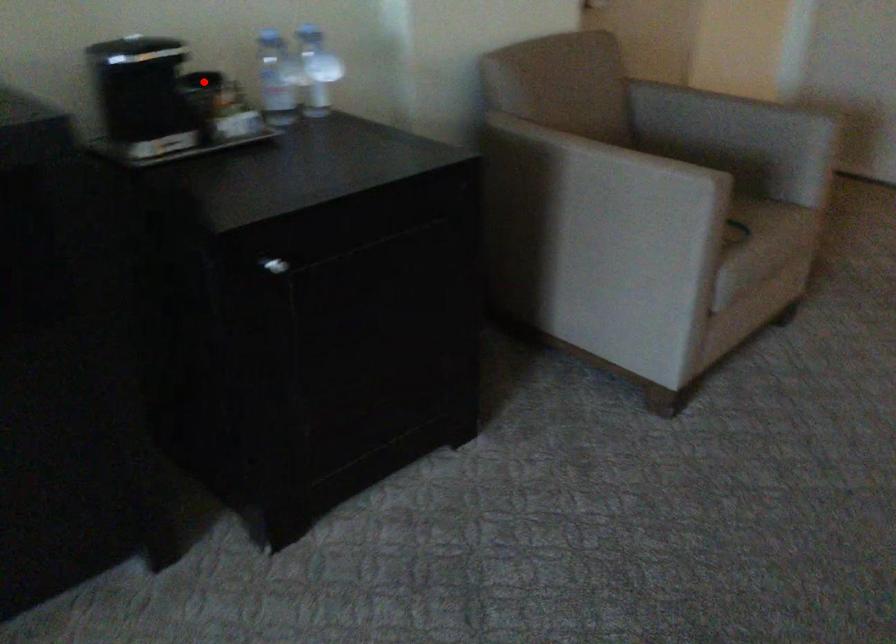
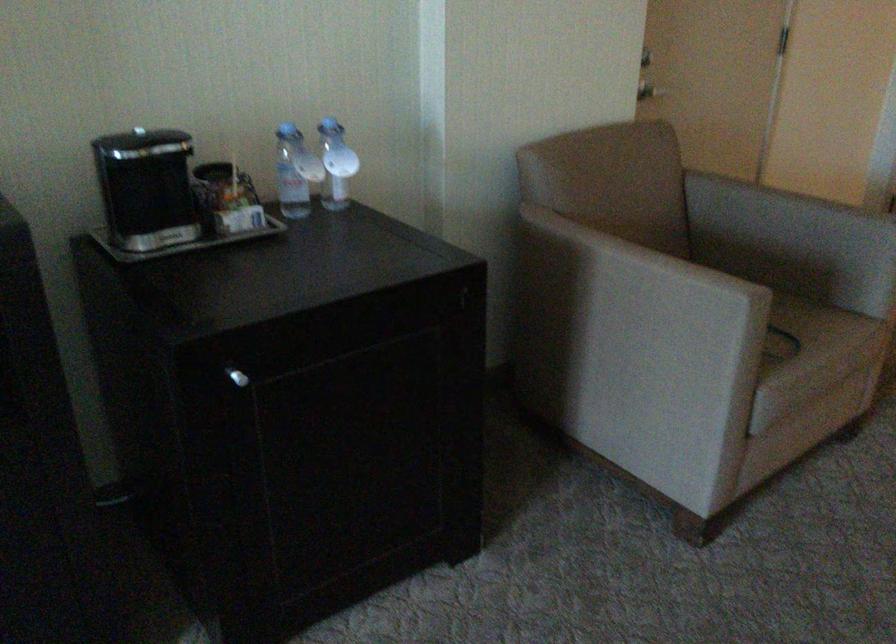
Find the pixel in the second image that matches the highlighted location in the first image.

(212, 171)